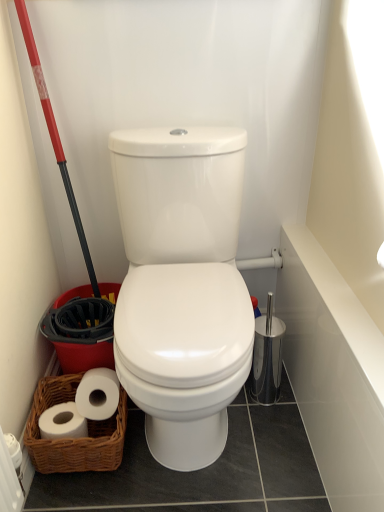
Question: Choose the correct answer: Is red plastic shovel at left inside white glossy bath at upper right or outside it?

Choices:
 (A) outside
 (B) inside

Answer: (A)

Question: Does point (110, 321) appear closer or farther from the camera than point (377, 503)?

Choices:
 (A) farther
 (B) closer

Answer: (A)

Question: Considering the real-world distances, which object is closest to the red plastic shovel at left?

Choices:
 (A) white glossy bath at upper right
 (B) woven brown basket at lower left

Answer: (B)

Question: Estimate the real-world distances between objects in this image. Which object is closer to the red plastic shovel at left?

Choices:
 (A) white glossy bath at upper right
 (B) woven brown basket at lower left

Answer: (B)